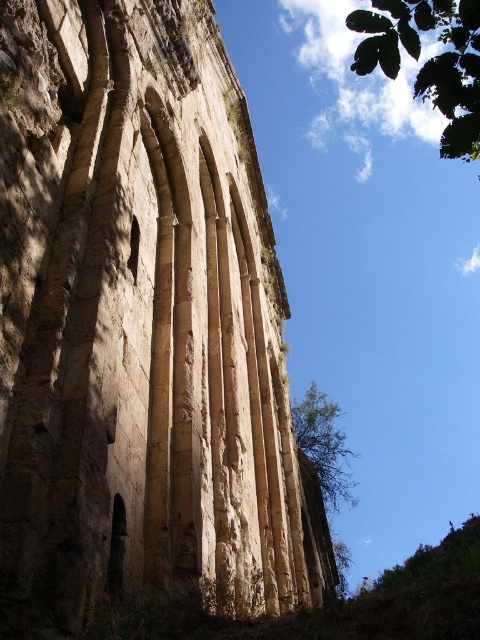
This screenshot has width=480, height=640. I want to click on rustic stone arches at center, so click(x=141, y=326).

Is point (9, 445) in front of point (360, 26)?

Yes, point (9, 445) is closer to viewer.

The width and height of the screenshot is (480, 640). I want to click on rustic stone arches at center, so click(141, 326).

From the picture: Is rustic stone arches at center bigger than green leafy tree at center?

No, rustic stone arches at center is not bigger than green leafy tree at center.

Which is in front, point (291, 545) or point (304, 420)?

Point (291, 545) is more forward.

Locate an element on the screen. rustic stone arches at center is located at coordinates (141, 326).

Based on the photo, can you confirm if green leafy tree at upper right is shorter than green leafy tree at center?

In fact, green leafy tree at upper right may be taller than green leafy tree at center.

Is green leafy tree at upper right wider than green leafy tree at center?

Yes, green leafy tree at upper right is wider than green leafy tree at center.

Is point (409, 13) farther from viewer compared to point (294, 435)?

No, it is in front of (294, 435).

This screenshot has width=480, height=640. Find the location of `green leafy tree at upper right`. green leafy tree at upper right is located at coordinates (429, 60).